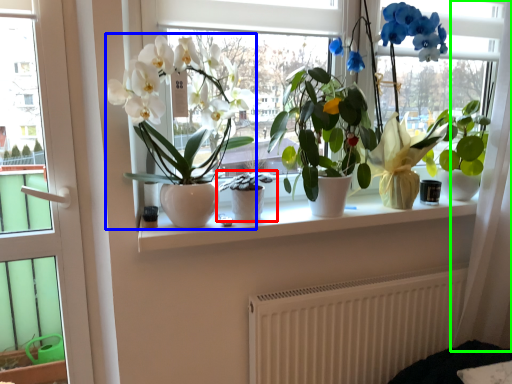
Question: Which object is positioned farthest from houseplant (highlighted by a red box)? Select from houseplant (highlighted by a blue box) and curtain (highlighted by a green box).

Choices:
 (A) houseplant
 (B) curtain

Answer: (B)